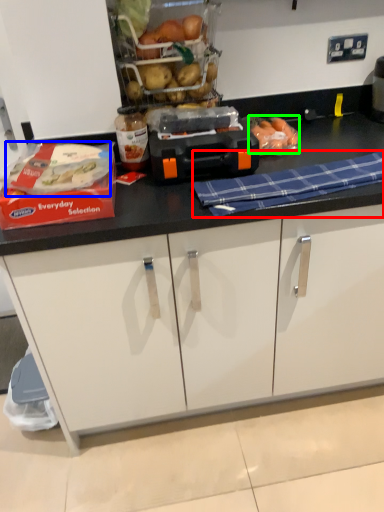
Question: Based on their relative distances, which object is nearer to blanket (highlighted by a red box)? Choose from food (highlighted by a blue box) and food (highlighted by a green box).

Choices:
 (A) food
 (B) food

Answer: (B)